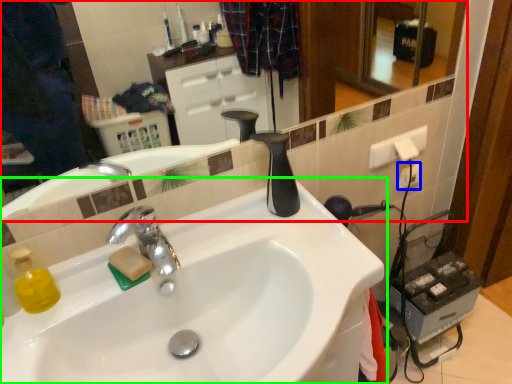
Question: Estimate the real-world distances between objects in this image. Which object is farther from mirror (highlighted by a red box), electric outlet (highlighted by a blue box) or sink (highlighted by a green box)?

Choices:
 (A) electric outlet
 (B) sink

Answer: (B)